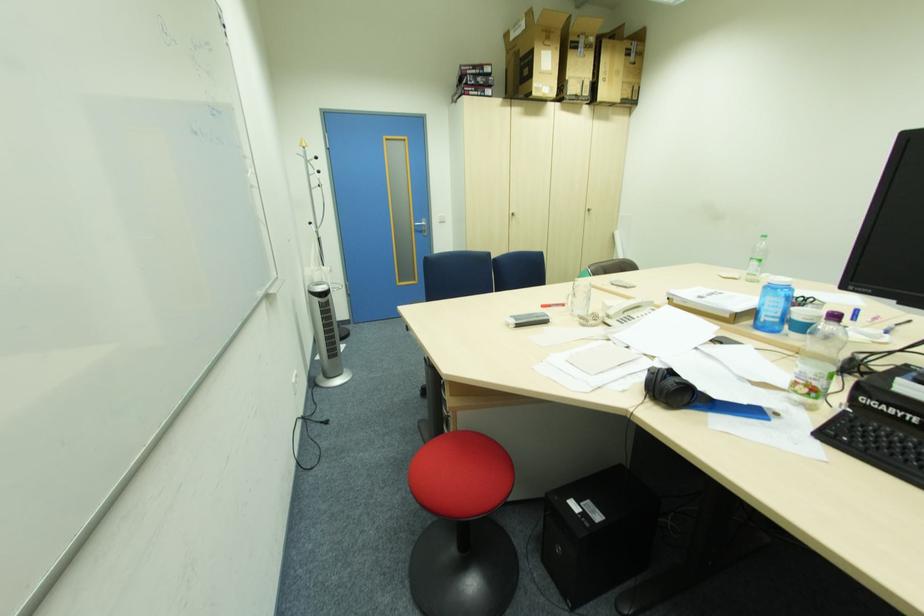
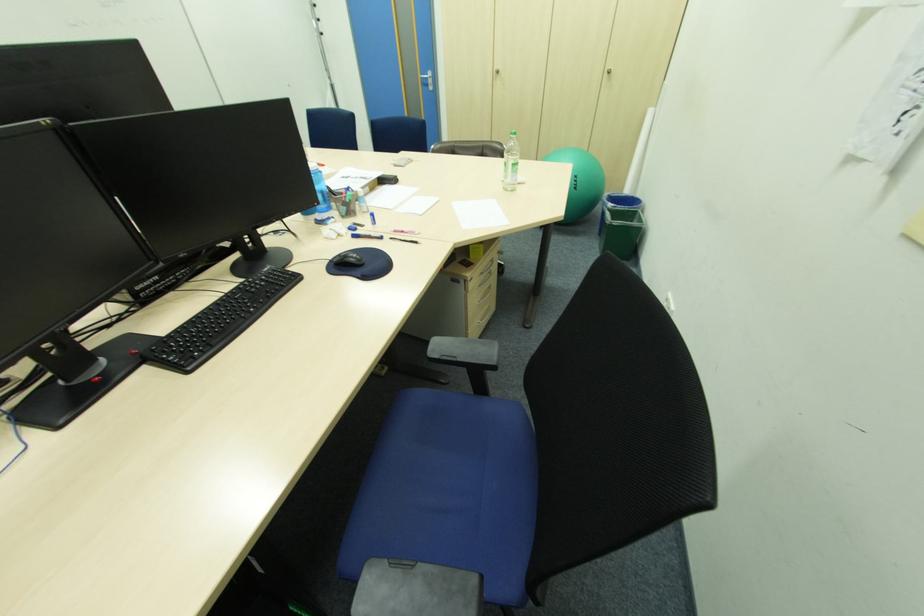
The point at (419, 227) is marked in the first image. Where is the corresponding point in the second image?

(428, 79)